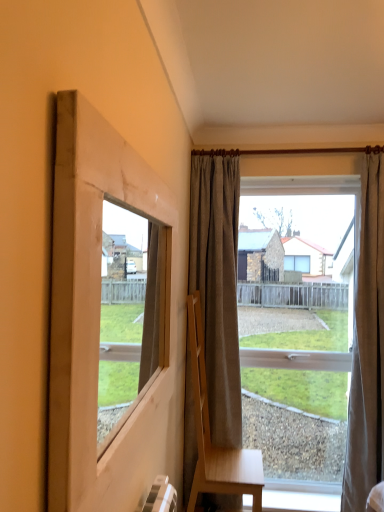
Describe the element at coordinates (309, 189) in the screenshot. The height and width of the screenshot is (512, 384). I see `clear glass window at center` at that location.

At what (x,y) coordinates should I click in order to perform the action: click on light brown wooden chair at center. Please return your answer as a coordinate pair (x, y). Looking at the image, I should click on (210, 437).

From the image's perspective, which one is positioned lower, clear glass window at center or gray fabric curtain at center, the 2th curtain in the right-to-left sequence?

From the image's view, clear glass window at center is below.

From a real-world perspective, is clear glass window at center positioned above or below gray fabric curtain at center, which appears as the 1th curtain when viewed from the left?

Clearly, from a real-world perspective, clear glass window at center is below gray fabric curtain at center, which appears as the 1th curtain when viewed from the left.

Which point is more distant from viewer, (x=381, y=150) or (x=216, y=331)?

The point (x=381, y=150) is behind.

Is clear glass window at center aimed at gray fabric curtain at center, which appears as the 1th curtain when viewed from the left?

No.

Is natural wood window frame at left taller or shorter than textured beige curtain at right, which is the first curtain in right-to-left order?

Considering their sizes, natural wood window frame at left has less height than textured beige curtain at right, which is the first curtain in right-to-left order.

Is natural wood window frame at left smaller than textured beige curtain at right, which is the first curtain in right-to-left order?

Yes.

Consider the image. Between natural wood window frame at left and textured beige curtain at right, which is the first curtain in right-to-left order, which one has smaller width?

natural wood window frame at left is thinner.

Is natural wood window frame at left oriented away from textured beige curtain at right, which is the first curtain in right-to-left order?

No.

Does gray fabric curtain at center, the 2th curtain in the right-to-left sequence, have a smaller size compared to natural wood window frame at left?

Actually, gray fabric curtain at center, the 2th curtain in the right-to-left sequence, might be larger than natural wood window frame at left.

From the image's perspective, is gray fabric curtain at center, the 2th curtain in the right-to-left sequence, located above or below natural wood window frame at left?

gray fabric curtain at center, the 2th curtain in the right-to-left sequence, is situated lower than natural wood window frame at left in the image.

In the scene shown: Does gray fabric curtain at center, the 2th curtain in the right-to-left sequence, contain natural wood window frame at left?

No, natural wood window frame at left is not surrounded by gray fabric curtain at center, the 2th curtain in the right-to-left sequence.

In the image, is gray fabric curtain at center, the 2th curtain in the right-to-left sequence, positioned in front of or behind natural wood window frame at left?

gray fabric curtain at center, the 2th curtain in the right-to-left sequence, is positioned farther from the viewer than natural wood window frame at left.

Where is `window below the gray fabric curtain at center, the 2th curtain in the right-to-left sequence (from the image's perspective)`? window below the gray fabric curtain at center, the 2th curtain in the right-to-left sequence (from the image's perspective) is located at coordinates (309, 189).

In the scene shown: Is gray fabric curtain at center, the 2th curtain in the right-to-left sequence, shorter than clear glass window at center?

No.

Does gray fabric curtain at center, which appears as the 1th curtain when viewed from the left, contain clear glass window at center?

No, gray fabric curtain at center, which appears as the 1th curtain when viewed from the left, does not contain clear glass window at center.

Can you tell me how much gray fabric curtain at center, the 2th curtain in the right-to-left sequence, and clear glass window at center differ in facing direction?

2.83 degrees.

From a real-world perspective, which is physically above, natural wood window frame at left or gray fabric curtain at center, which appears as the 1th curtain when viewed from the left?

natural wood window frame at left, from a real-world perspective.

From the image's perspective, is natural wood window frame at left beneath gray fabric curtain at center, the 2th curtain in the right-to-left sequence?

No, from the image's perspective, natural wood window frame at left is not below gray fabric curtain at center, the 2th curtain in the right-to-left sequence.

Is point (165, 344) positioned in front of point (229, 272)?

Yes, it is.

Which object is further away from the camera taking this photo, natural wood window frame at left or gray fabric curtain at center, which appears as the 1th curtain when viewed from the left?

gray fabric curtain at center, which appears as the 1th curtain when viewed from the left, is more distant.

Is point (373, 469) more distant than point (201, 170)?

No, it is not.

From the image's perspective, is textured beige curtain at right, which is the first curtain in right-to-left order, located beneath gray fabric curtain at center, which appears as the 1th curtain when viewed from the left?

Yes.

From a real-world perspective, relative to gray fabric curtain at center, the 2th curtain in the right-to-left sequence, is textured beige curtain at right, which is the first curtain in right-to-left order, vertically above or below?

textured beige curtain at right, which is the first curtain in right-to-left order, is below gray fabric curtain at center, the 2th curtain in the right-to-left sequence.

Find the location of a particular element. curtain behind the textured beige curtain at right, which is the 2th curtain from left to right is located at coordinates (217, 287).

Is natural wood window frame at left surrounding light brown wooden chair at center?

Definitely not — light brown wooden chair at center is not inside natural wood window frame at left.

Could you tell me if natural wood window frame at left is turned towards light brown wooden chair at center?

No, natural wood window frame at left does not turn towards light brown wooden chair at center.

Consider the image. From the image's perspective, relative to light brown wooden chair at center, is natural wood window frame at left above or below?

natural wood window frame at left is situated higher than light brown wooden chair at center in the image.

Considering the relative sizes of natural wood window frame at left and light brown wooden chair at center in the image provided, is natural wood window frame at left bigger than light brown wooden chair at center?

Actually, natural wood window frame at left might be smaller than light brown wooden chair at center.

In order to click on window below the gray fabric curtain at center, which appears as the 1th curtain when viewed from the left (from the image's perspective) in this screenshot , I will do `click(309, 189)`.

The image size is (384, 512). Identify the location of window frame that is in front of the textured beige curtain at right, which is the 2th curtain from left to right. (99, 318).

Looking at the image, which one is located further to gray fabric curtain at center, the 2th curtain in the right-to-left sequence, light brown wooden chair at center or clear glass window at center?

clear glass window at center.

Looking at the image, which one is located closer to clear glass window at center, light brown wooden chair at center or textured beige curtain at right, which is the first curtain in right-to-left order?

textured beige curtain at right, which is the first curtain in right-to-left order, is closer to clear glass window at center.

Based on their spatial positions, is light brown wooden chair at center or clear glass window at center further from natural wood window frame at left?

clear glass window at center is further to natural wood window frame at left.

From the image, which object appears to be farther from natural wood window frame at left, textured beige curtain at right, which is the 2th curtain from left to right, or light brown wooden chair at center?

textured beige curtain at right, which is the 2th curtain from left to right, is further to natural wood window frame at left.

When comparing their distances from natural wood window frame at left, does textured beige curtain at right, which is the first curtain in right-to-left order, or gray fabric curtain at center, which appears as the 1th curtain when viewed from the left, seem further?

textured beige curtain at right, which is the first curtain in right-to-left order.

From the image, which object appears to be farther from clear glass window at center, textured beige curtain at right, which is the 2th curtain from left to right, or gray fabric curtain at center, the 2th curtain in the right-to-left sequence?

The object further to clear glass window at center is gray fabric curtain at center, the 2th curtain in the right-to-left sequence.

From the image, which object appears to be nearer to clear glass window at center, natural wood window frame at left or light brown wooden chair at center?

light brown wooden chair at center lies closer to clear glass window at center than the other object.

Which object lies further to the anchor point clear glass window at center, light brown wooden chair at center or natural wood window frame at left?

The object further to clear glass window at center is natural wood window frame at left.

The height and width of the screenshot is (512, 384). In order to click on window between light brown wooden chair at center and textured beige curtain at right, which is the 2th curtain from left to right in this screenshot , I will do `click(309, 189)`.

Locate an element on the screen. chair between natural wood window frame at left and textured beige curtain at right, which is the first curtain in right-to-left order, along the z-axis is located at coordinates (210, 437).

I want to click on chair between natural wood window frame at left and clear glass window at center from front to back, so click(210, 437).

Identify the location of window between gray fabric curtain at center, the 2th curtain in the right-to-left sequence, and textured beige curtain at right, which is the first curtain in right-to-left order, in the horizontal direction. This screenshot has height=512, width=384. (309, 189).